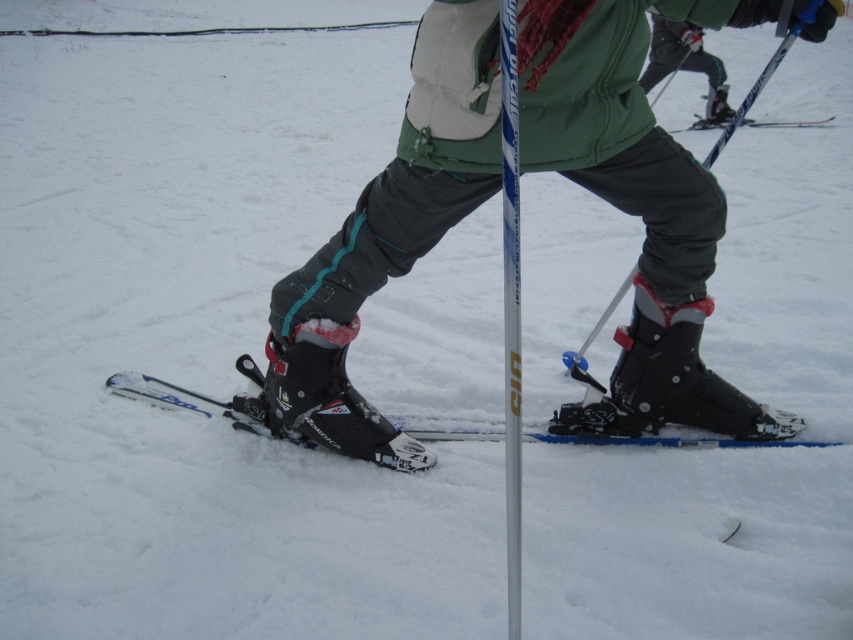
You are standing at the point marked as point (730,440) and want to take a photo of the skier. Considering the distance between you and the viewer is 7.99 feet, will you be able to capture the entire skier in your camera frame?

The distance between you and the viewer is 7.99 feet. Since the skier is in motion and the point is marked as your position, you need to ensure your camera frame can encompass the skier at that distance. However, without knowing the camera lens specifications or the skier size, it is impossible to determine if the entire skier will fit in the frame.

You are a photographer trying to capture the skier in the image. You want to ensure both the matte black ski boot at center and the blue metallic ski pole at center are clearly visible in your shot. Considering their sizes, which object should you focus on first to ensure it doesn

The matte black ski boot at center occupies less space than the blue metallic ski pole at center. Therefore, you should focus on the blue metallic ski pole at center first since it is larger and will be easier to capture clearly, ensuring the smaller boot remains in frame.